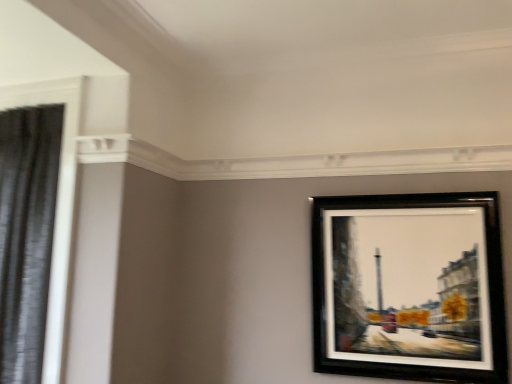
You are a GUI agent. You are given a task and a screenshot of the screen. Output one action in this format:
    pyautogui.click(x=<x>, y=<y>)
    Task: Click on the black glossy picture frame at upper right
    Image resolution: width=512 pixels, height=384 pixels.
    Given the screenshot: What is the action you would take?
    pyautogui.click(x=410, y=286)

What do you see at coordinates (410, 286) in the screenshot? This screenshot has width=512, height=384. I see `black glossy picture frame at upper right` at bounding box center [410, 286].

What do you see at coordinates (26, 234) in the screenshot? This screenshot has width=512, height=384. I see `black fabric shower curtain at left` at bounding box center [26, 234].

Locate an element on the screen. This screenshot has width=512, height=384. black fabric shower curtain at left is located at coordinates (26, 234).

The height and width of the screenshot is (384, 512). Identify the location of black glossy picture frame at upper right. (410, 286).

Which object is positioned more to the right, black fabric shower curtain at left or black glossy picture frame at upper right?

black glossy picture frame at upper right is more to the right.

Which object is further away from the camera taking this photo, black fabric shower curtain at left or black glossy picture frame at upper right?

black glossy picture frame at upper right is further away from the camera.

Which point is more distant from viewer, (40, 310) or (375, 363)?

The point (375, 363) is more distant.

From the image's perspective, which object appears higher, black fabric shower curtain at left or black glossy picture frame at upper right?

black fabric shower curtain at left, from the image's perspective.

From a real-world perspective, does black fabric shower curtain at left sit lower than black glossy picture frame at upper right?

No, from a real-world perspective, black fabric shower curtain at left is not under black glossy picture frame at upper right.

Does black fabric shower curtain at left have a greater width compared to black glossy picture frame at upper right?

Indeed, black fabric shower curtain at left has a greater width compared to black glossy picture frame at upper right.

From their relative heights in the image, would you say black fabric shower curtain at left is taller or shorter than black glossy picture frame at upper right?

black fabric shower curtain at left is taller than black glossy picture frame at upper right.

Who is smaller, black fabric shower curtain at left or black glossy picture frame at upper right?

black glossy picture frame at upper right.

Is black fabric shower curtain at left inside or outside of black glossy picture frame at upper right?

black fabric shower curtain at left exists outside the volume of black glossy picture frame at upper right.

Can you see black fabric shower curtain at left touching black glossy picture frame at upper right?

No, black fabric shower curtain at left is not beside black glossy picture frame at upper right.

Is black glossy picture frame at upper right at the back of black fabric shower curtain at left?

No, black fabric shower curtain at left is not facing away from black glossy picture frame at upper right.

How many degrees apart are the facing directions of black fabric shower curtain at left and black glossy picture frame at upper right?

0.0027 degrees.

How distant is black fabric shower curtain at left from black glossy picture frame at upper right?

black fabric shower curtain at left and black glossy picture frame at upper right are 1.83 meters apart.

At what (x,y) coordinates should I click in order to perform the action: click on picture frame behind the black fabric shower curtain at left. Please return your answer as a coordinate pair (x, y). Looking at the image, I should click on tap(410, 286).

Which is more to the left, black glossy picture frame at upper right or black fabric shower curtain at left?

black fabric shower curtain at left.

Which is in front, black glossy picture frame at upper right or black fabric shower curtain at left?

black fabric shower curtain at left is more forward.

Does point (481, 379) come farther from viewer compared to point (41, 110)?

No, (481, 379) is in front of (41, 110).

From the image's perspective, which is below, black glossy picture frame at upper right or black fabric shower curtain at left?

From the image's view, black glossy picture frame at upper right is below.

From a real-world perspective, who is located higher, black glossy picture frame at upper right or black fabric shower curtain at left?

black fabric shower curtain at left.

Does black glossy picture frame at upper right have a greater width compared to black fabric shower curtain at left?

Incorrect, the width of black glossy picture frame at upper right does not surpass that of black fabric shower curtain at left.

Is black glossy picture frame at upper right taller than black fabric shower curtain at left?

Incorrect, the height of black glossy picture frame at upper right is not larger of that of black fabric shower curtain at left.

Who is bigger, black glossy picture frame at upper right or black fabric shower curtain at left?

black fabric shower curtain at left.

Is black glossy picture frame at upper right spatially inside black fabric shower curtain at left, or outside of it?

black glossy picture frame at upper right is not enclosed by black fabric shower curtain at left.

Is there a large distance between black glossy picture frame at upper right and black fabric shower curtain at left?

Yes, black glossy picture frame at upper right and black fabric shower curtain at left are quite far apart.

Is black glossy picture frame at upper right turned away from black fabric shower curtain at left?

No, black glossy picture frame at upper right is not facing the opposite direction of black fabric shower curtain at left.

I want to click on shower curtain to the left of black glossy picture frame at upper right, so click(26, 234).

This screenshot has width=512, height=384. I want to click on shower curtain in front of the black glossy picture frame at upper right, so click(x=26, y=234).

The width and height of the screenshot is (512, 384). I want to click on shower curtain above the black glossy picture frame at upper right (from the image's perspective), so click(26, 234).